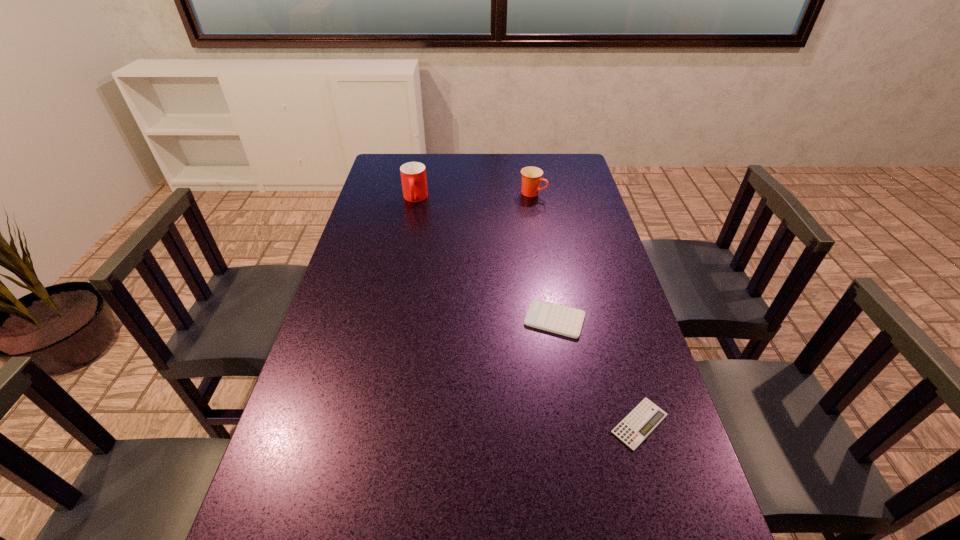
The height and width of the screenshot is (540, 960). Find the location of `blank space located 0.370m on the back of the third tallest object`. blank space located 0.370m on the back of the third tallest object is located at coordinates (539, 226).

This screenshot has width=960, height=540. I want to click on blank area located 0.300m on the left of the nearest object, so coord(473,423).

Find the location of a particular element. The height and width of the screenshot is (540, 960). object that is at the left edge is located at coordinates (413, 174).

This screenshot has width=960, height=540. In order to click on blank space at the far edge of the desktop in this screenshot , I will do `click(439, 161)`.

At what (x,y) coordinates should I click in order to perform the action: click on free space at the left edge of the desktop. Please return your answer as a coordinate pair (x, y). This screenshot has width=960, height=540. Looking at the image, I should click on (316, 421).

This screenshot has width=960, height=540. In order to click on free spot at the right edge of the desktop in this screenshot , I will do `click(604, 420)`.

The width and height of the screenshot is (960, 540). What are the coordinates of `free space that is in between the shorter cup and the taller calculator` in the screenshot? It's located at (543, 256).

Find the location of a particular element. The image size is (960, 540). unoccupied position between the shorter calculator and the second nearest object is located at coordinates tap(597, 372).

The image size is (960, 540). Find the location of `free space between the taller cup and the shortest object`. free space between the taller cup and the shortest object is located at coordinates (527, 311).

Image resolution: width=960 pixels, height=540 pixels. I want to click on free space between the third shortest object and the third farthest object, so click(543, 256).